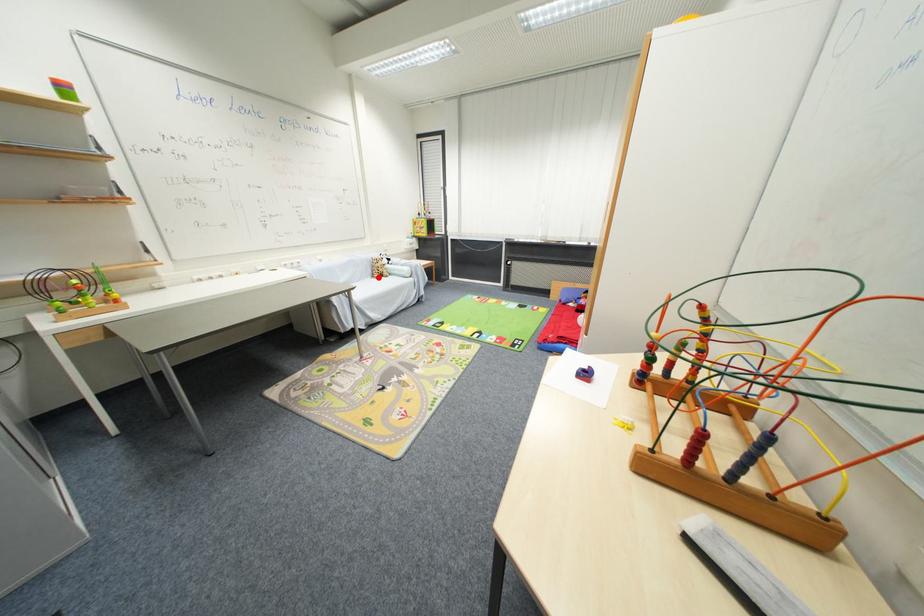
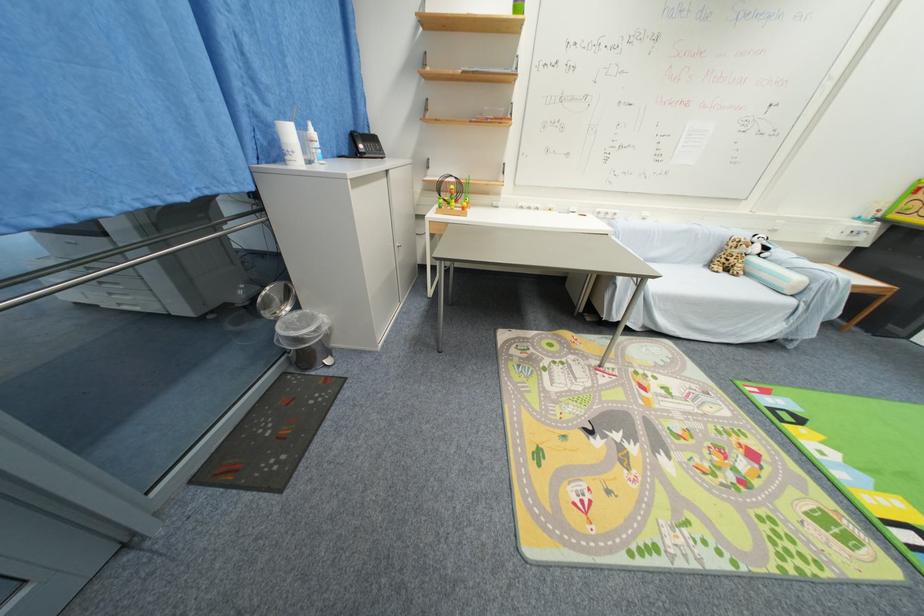
The point at the highlighted location is marked in the first image. Where is the corresponding point in the second image?

(714, 265)